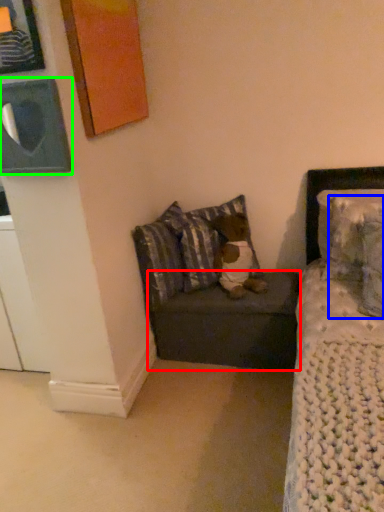
Question: Considering the real-world distances, which object is farthest from table (highlighted by a red box)? pillow (highlighted by a blue box) or picture frame (highlighted by a green box)?

Choices:
 (A) pillow
 (B) picture frame

Answer: (B)